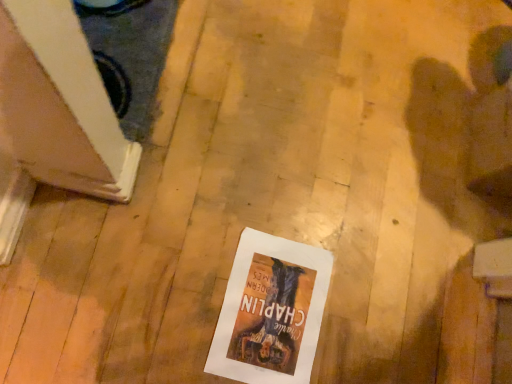
At what (x,y) coordinates should I click in order to perform the action: click on free space above white paper poster at center (from a real-world perspective). Please return your answer as a coordinate pair (x, y). Looking at the image, I should click on (280, 304).